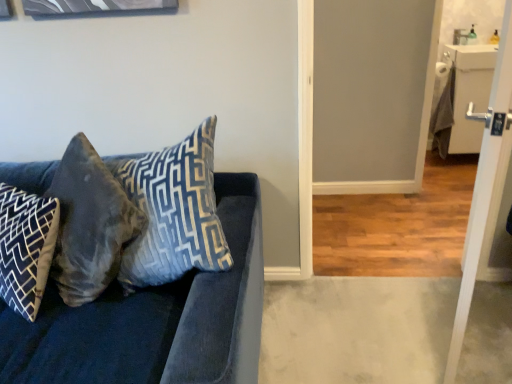
Question: From a real-world perspective, is velvet blue pillow at center, the 1th pillow viewed from the right, physically below velvet blue couch at left?

Choices:
 (A) yes
 (B) no

Answer: (B)

Question: From a real-world perspective, is velvet blue pillow at center, the 1th pillow viewed from the right, located higher than velvet blue couch at left?

Choices:
 (A) yes
 (B) no

Answer: (A)

Question: Considering the relative sizes of velvet blue pillow at center, the 3th pillow in the left-to-right sequence, and velvet blue couch at left in the image provided, is velvet blue pillow at center, the 3th pillow in the left-to-right sequence, bigger than velvet blue couch at left?

Choices:
 (A) no
 (B) yes

Answer: (A)

Question: Considering the relative sizes of velvet blue pillow at center, the 1th pillow viewed from the right, and velvet blue couch at left in the image provided, is velvet blue pillow at center, the 1th pillow viewed from the right, smaller than velvet blue couch at left?

Choices:
 (A) no
 (B) yes

Answer: (B)

Question: Can you confirm if velvet blue pillow at center, the 1th pillow viewed from the right, is wider than velvet blue couch at left?

Choices:
 (A) no
 (B) yes

Answer: (A)

Question: From the image's perspective, is velvet blue pillow at center, the 1th pillow viewed from the right, on top of velvet blue couch at left?

Choices:
 (A) yes
 (B) no

Answer: (A)

Question: Is white glossy door at right taller than velvet blue pillow at center, the 1th pillow viewed from the right?

Choices:
 (A) yes
 (B) no

Answer: (A)

Question: From a real-world perspective, is white glossy door at right positioned over velvet blue pillow at center, the 1th pillow viewed from the right, based on gravity?

Choices:
 (A) no
 (B) yes

Answer: (A)

Question: Is white glossy door at right aimed at velvet blue pillow at center, the 1th pillow viewed from the right?

Choices:
 (A) no
 (B) yes

Answer: (B)

Question: Is white glossy door at right thinner than velvet blue pillow at center, the 1th pillow viewed from the right?

Choices:
 (A) yes
 (B) no

Answer: (A)

Question: Is the position of white glossy door at right more distant than that of velvet blue pillow at center, the 1th pillow viewed from the right?

Choices:
 (A) yes
 (B) no

Answer: (B)

Question: Is white glossy door at right turned away from velvet blue pillow at center, the 1th pillow viewed from the right?

Choices:
 (A) no
 (B) yes

Answer: (A)

Question: Can you confirm if blue-patterned fabric pillow at left, which is the third pillow from right to left, is shorter than white glossy door at right?

Choices:
 (A) yes
 (B) no

Answer: (A)